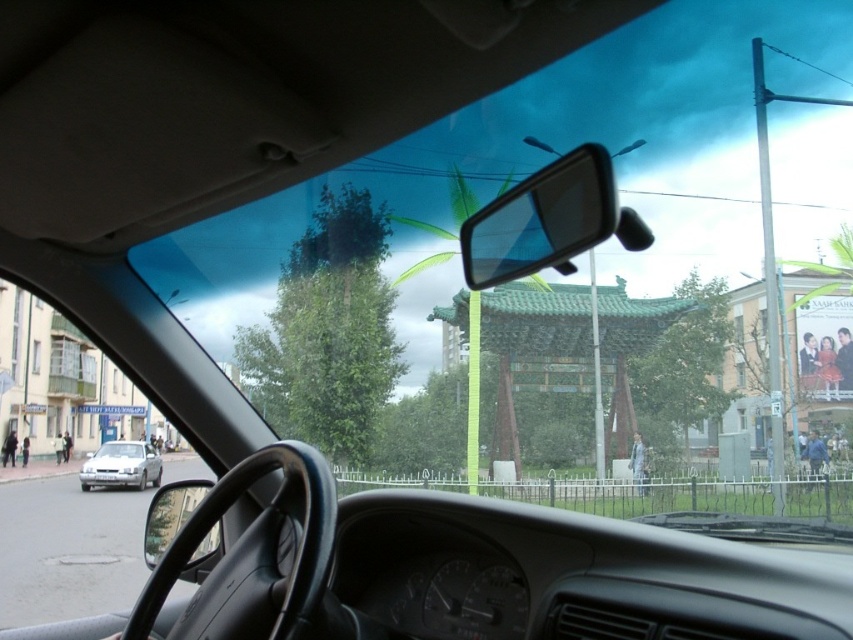
Which is in front, point (579, 237) or point (131, 476)?

Positioned in front is point (579, 237).

Does clear plastic mirror at upper center appear on the left side of silver metallic sedan at lower left?

In fact, clear plastic mirror at upper center is to the right of silver metallic sedan at lower left.

Which is behind, point (640, 237) or point (119, 476)?

The point (119, 476) is more distant.

This screenshot has height=640, width=853. I want to click on clear plastic mirror at upper center, so click(548, 220).